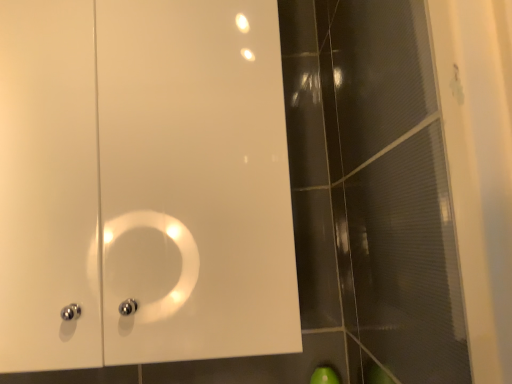
Question: Can you confirm if transparent textured glass door at right is bigger than white glossy cabinet at upper left?

Choices:
 (A) no
 (B) yes

Answer: (A)

Question: Can we say transparent textured glass door at right lies outside white glossy cabinet at upper left?

Choices:
 (A) no
 (B) yes

Answer: (B)

Question: From the image's perspective, does transparent textured glass door at right appear higher than white glossy cabinet at upper left?

Choices:
 (A) no
 (B) yes

Answer: (A)

Question: Can you confirm if transparent textured glass door at right is wider than white glossy cabinet at upper left?

Choices:
 (A) yes
 (B) no

Answer: (B)

Question: Considering the relative sizes of transparent textured glass door at right and white glossy cabinet at upper left in the image provided, is transparent textured glass door at right shorter than white glossy cabinet at upper left?

Choices:
 (A) no
 (B) yes

Answer: (A)

Question: Can you confirm if transparent textured glass door at right is taller than white glossy cabinet at upper left?

Choices:
 (A) no
 (B) yes

Answer: (B)

Question: From the image's perspective, is white glossy cabinet at upper left below transparent textured glass door at right?

Choices:
 (A) no
 (B) yes

Answer: (A)

Question: Does white glossy cabinet at upper left have a smaller size compared to transparent textured glass door at right?

Choices:
 (A) no
 (B) yes

Answer: (A)

Question: Is white glossy cabinet at upper left facing towards transparent textured glass door at right?

Choices:
 (A) no
 (B) yes

Answer: (A)

Question: Can you confirm if white glossy cabinet at upper left is positioned to the left of transparent textured glass door at right?

Choices:
 (A) yes
 (B) no

Answer: (A)

Question: Is white glossy cabinet at upper left bigger than transparent textured glass door at right?

Choices:
 (A) no
 (B) yes

Answer: (B)

Question: Can you confirm if white glossy cabinet at upper left is thinner than transparent textured glass door at right?

Choices:
 (A) no
 (B) yes

Answer: (A)

Question: In terms of height, does transparent textured glass door at right look taller or shorter compared to white glossy cabinet at upper left?

Choices:
 (A) tall
 (B) short

Answer: (A)